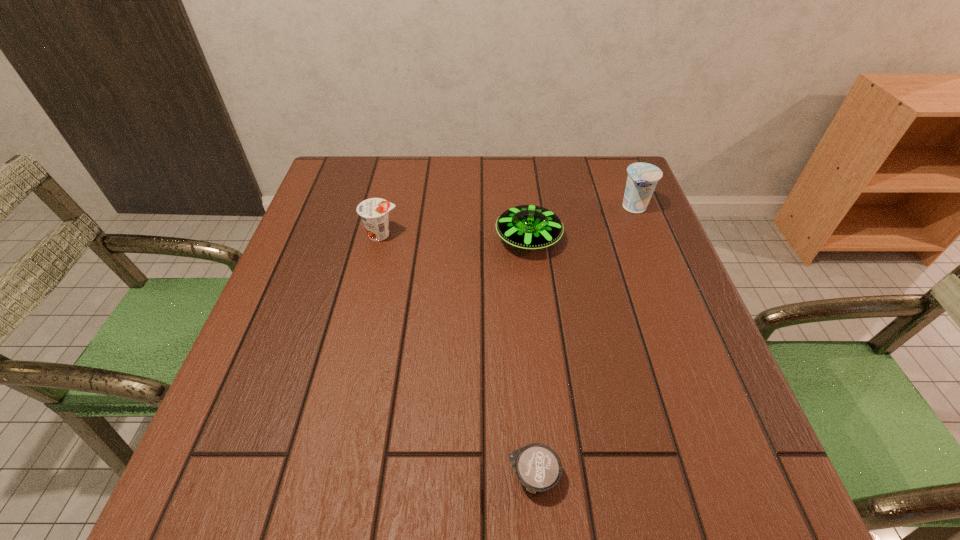
In order to click on unoccupied position between the leftmost object and the second yogurt from left to right in this screenshot , I will do `click(457, 356)`.

At what (x,y) coordinates should I click in order to perform the action: click on object identified as the closest to the saucer. Please return your answer as a coordinate pair (x, y). This screenshot has width=960, height=540. Looking at the image, I should click on (642, 179).

Find the location of a particular element. Image resolution: width=960 pixels, height=540 pixels. the third closest object to the saucer is located at coordinates (538, 467).

Where is `the closest yogurt to the tallest yogurt`? The height and width of the screenshot is (540, 960). the closest yogurt to the tallest yogurt is located at coordinates (374, 212).

Image resolution: width=960 pixels, height=540 pixels. Find the location of `yogurt that is the second nearest to the second nearest yogurt`. yogurt that is the second nearest to the second nearest yogurt is located at coordinates (642, 179).

I want to click on free space that satisfies the following two spatial constraints: 1. on the back side of the second farthest yogurt; 2. on the left side of the farthest object, so click(x=388, y=207).